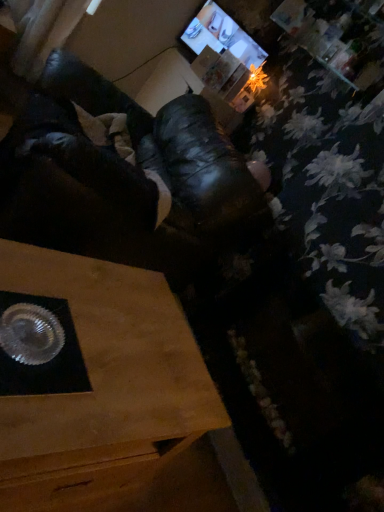
In order to click on vacant region above wooden table at lower left (from a real-world perspective) in this screenshot , I will do `click(109, 340)`.